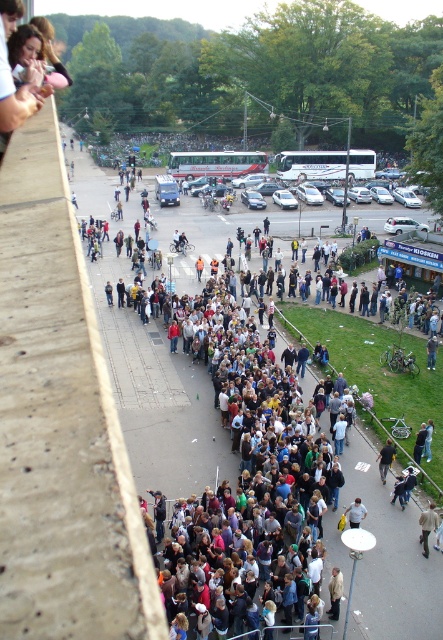
You are a photographer standing at the edge of the crowd. You want to take a photo of the light blue shirt at center without the dark blue jeans at lower center blocking it. Is this possible given their positions?

The dark blue jeans at lower center is positioned over light blue shirt at center, so it will block the view of the light blue shirt at center. Therefore, it is not possible to take a photo of the light blue shirt at center without the dark blue jeans at lower center blocking it.